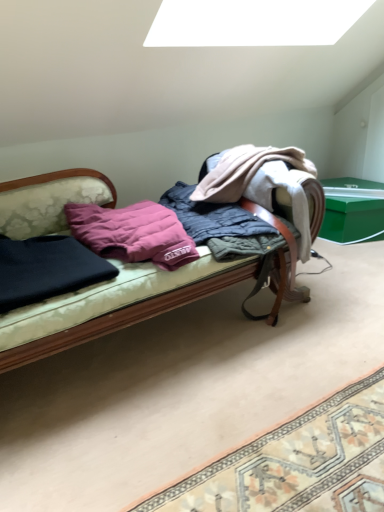
Find the location of a particular element. The height and width of the screenshot is (512, 384). vacant space behind patterned fabric mat at lower right is located at coordinates (284, 358).